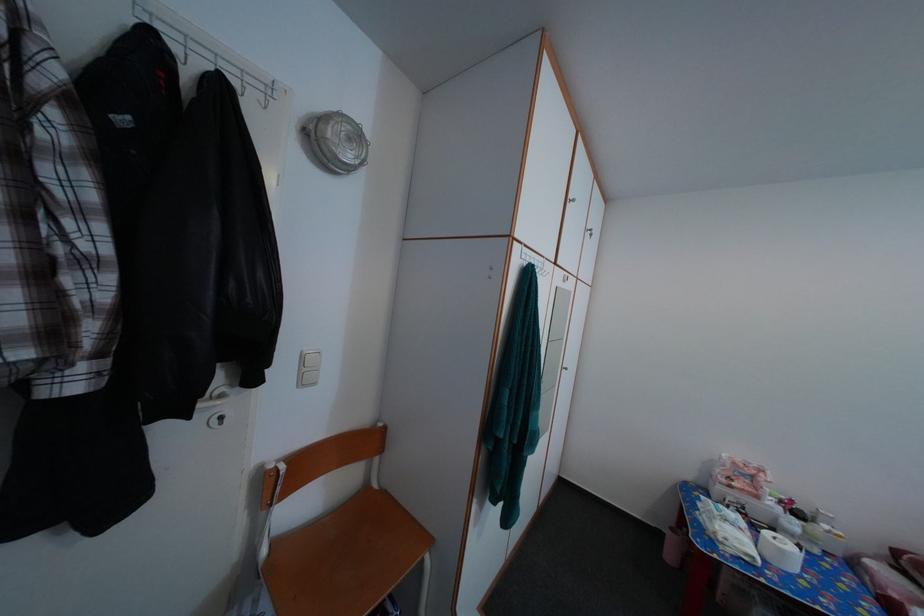
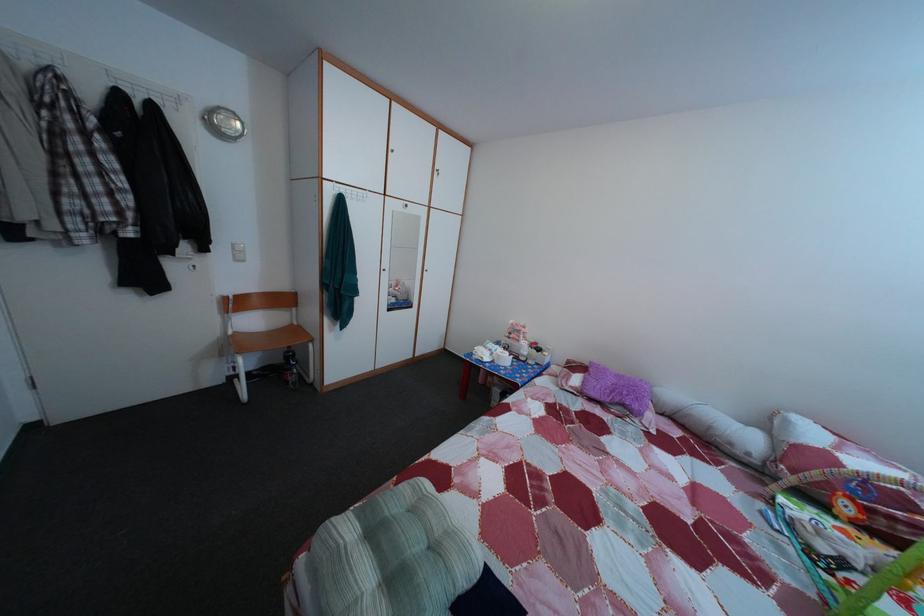
Find the pixel in the second image that matches point (282, 552) in the first image.

(245, 339)